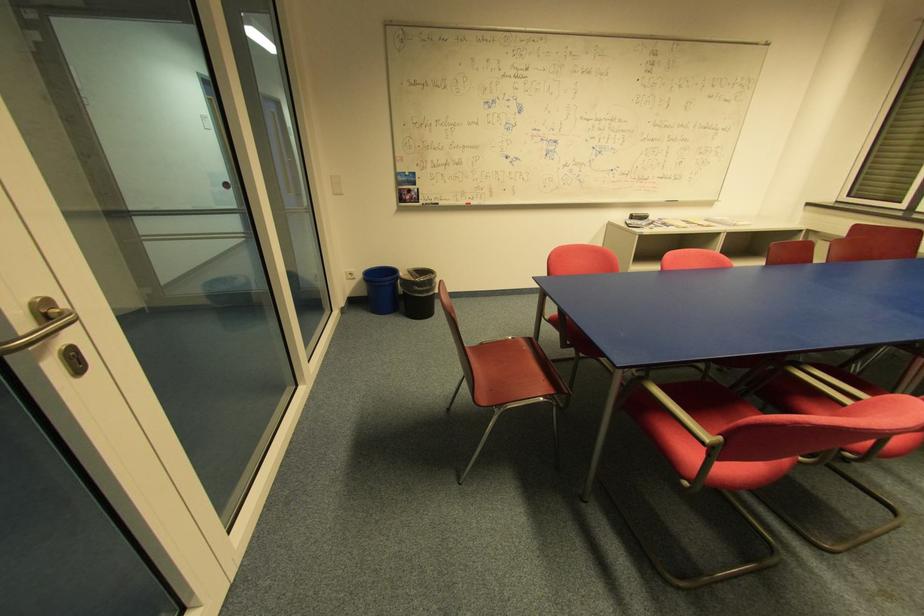
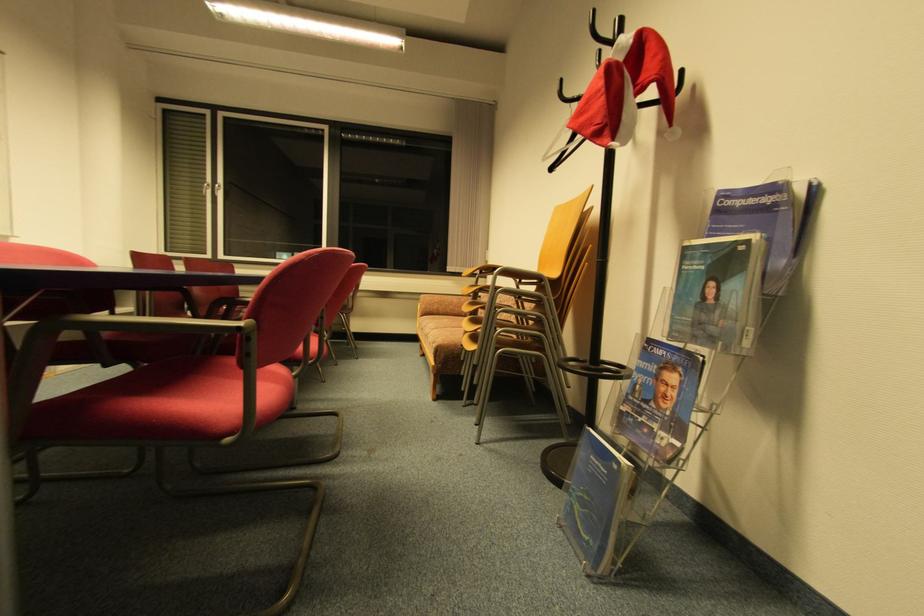
Question: The images are taken continuously from a first-person perspective. In which direction is your viewpoint rotating?

Choices:
 (A) Left
 (B) Right
 (C) Up
 (D) Down

Answer: (B)